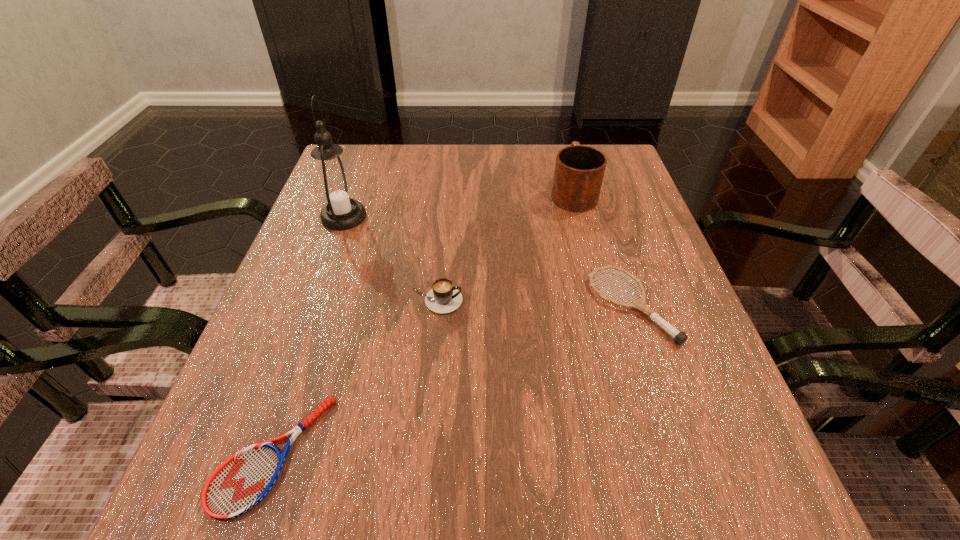
Identify the location of vacant region that satisfies the following two spatial constraints: 1. on the front side of the right tennis racket; 2. on the right side of the tallest object. pyautogui.click(x=312, y=306).